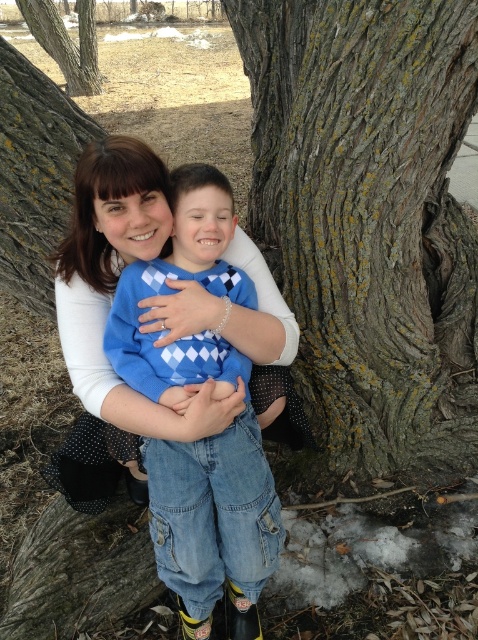
Question: Does rough bark tree at center appear on the right side of blue argyle sweater at center?

Choices:
 (A) no
 (B) yes

Answer: (B)

Question: Observing the image, what is the correct spatial positioning of rough bark tree at center in reference to rough bark tree at upper left?

Choices:
 (A) below
 (B) above

Answer: (A)

Question: Considering the real-world distances, which object is farthest from the rough bark tree at upper left?

Choices:
 (A) rough bark tree at center
 (B) blue argyle sweater at center

Answer: (B)

Question: Which is nearer to the rough bark tree at center?

Choices:
 (A) blue argyle sweater at center
 (B) rough bark tree at upper left

Answer: (A)

Question: Does rough bark tree at center have a larger size compared to blue argyle sweater at center?

Choices:
 (A) yes
 (B) no

Answer: (A)

Question: Which object is the farthest from the blue argyle sweater at center?

Choices:
 (A) rough bark tree at center
 (B) rough bark tree at upper left

Answer: (B)